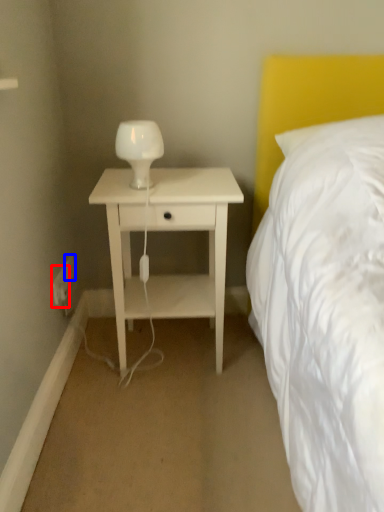
Question: Which of the following is the closest to the observer, electric outlet (highlighted by a red box) or electric outlet (highlighted by a blue box)?

Choices:
 (A) electric outlet
 (B) electric outlet

Answer: (A)